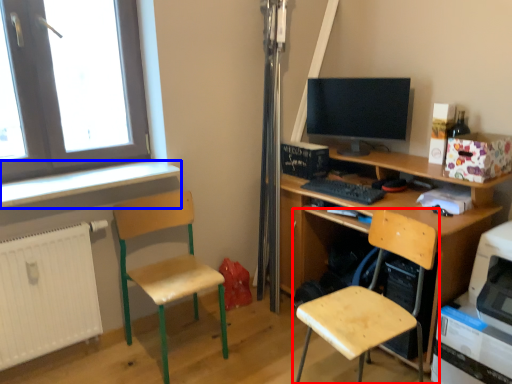
Question: Which object is further to the camera taking this photo, chair (highlighted by a red box) or window sill (highlighted by a blue box)?

Choices:
 (A) chair
 (B) window sill

Answer: (B)